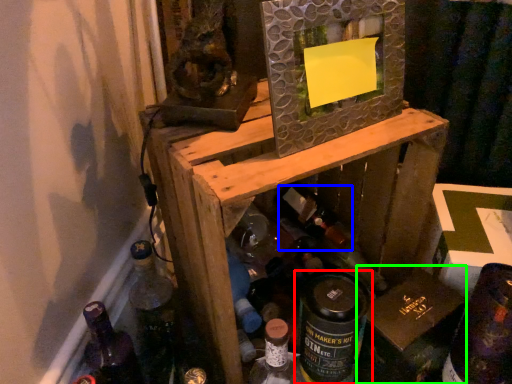
Question: Estimate the real-world distances between objects in this image. Which object is closer to bottle (highlighted by a red box), wine bottle (highlighted by a blue box) or cardboard box (highlighted by a green box)?

Choices:
 (A) wine bottle
 (B) cardboard box

Answer: (B)